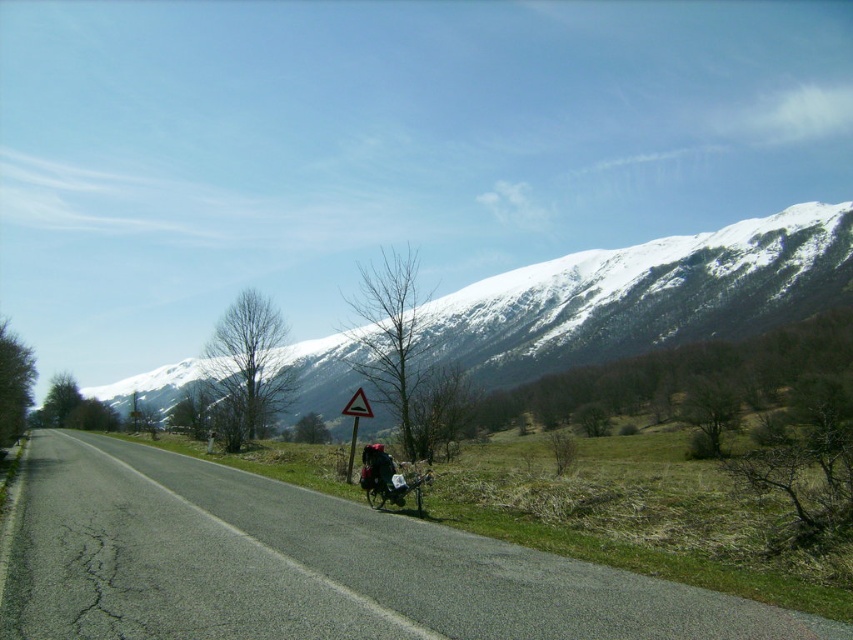
Is snowy mountain at upper center wider than metallic silver motorcycle at center?

Correct, the width of snowy mountain at upper center exceeds that of metallic silver motorcycle at center.

Is point (486, 300) behind point (399, 472)?

Yes, it is behind point (399, 472).

Locate an element on the screen. snowy mountain at upper center is located at coordinates (645, 296).

Which of these two, snowy mountain at upper center or triangular reflective plastic traffic sign at center, stands shorter?

triangular reflective plastic traffic sign at center is shorter.

Does snowy mountain at upper center have a greater width compared to triangular reflective plastic traffic sign at center?

Yes, snowy mountain at upper center is wider than triangular reflective plastic traffic sign at center.

Measure the distance between snowy mountain at upper center and camera.

snowy mountain at upper center and camera are 44.96 meters apart.

Locate an element on the screen. The image size is (853, 640). snowy mountain at upper center is located at coordinates (645, 296).

Based on the photo, is asphalt road at center to the right of metallic silver motorcycle at center from the viewer's perspective?

Incorrect, asphalt road at center is not on the right side of metallic silver motorcycle at center.

Does asphalt road at center come behind metallic silver motorcycle at center?

No, it is in front of metallic silver motorcycle at center.

Is point (543, 609) positioned behind point (424, 480)?

No.

This screenshot has height=640, width=853. Find the location of `asphalt road at center`. asphalt road at center is located at coordinates (308, 566).